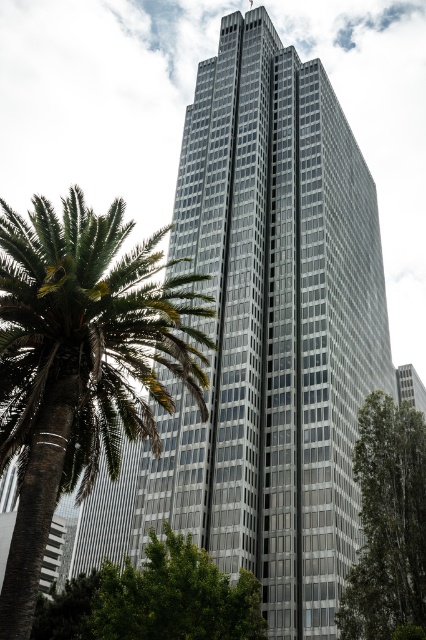
Who is taller, green leafy palm tree at left or green leafy tree at right?

Standing taller between the two is green leafy tree at right.

Looking at this image, is green leafy palm tree at left smaller than green leafy tree at right?

No, green leafy palm tree at left is not smaller than green leafy tree at right.

Is point (94, 326) behind point (417, 468)?

No, (94, 326) is closer to viewer.

Identify the location of green leafy palm tree at left. (80, 364).

Measure the distance between green leafy palm tree at left and green leafy tree at center.

green leafy palm tree at left is 41.79 feet away from green leafy tree at center.

Does point (112, 368) lie behind point (226, 584)?

That is False.

Image resolution: width=426 pixels, height=640 pixels. What do you see at coordinates (80, 364) in the screenshot?
I see `green leafy palm tree at left` at bounding box center [80, 364].

The image size is (426, 640). What are the coordinates of `green leafy palm tree at left` in the screenshot? It's located at (80, 364).

Does green leafy tree at right have a greater width compared to green leafy tree at center?

Incorrect, green leafy tree at right's width does not surpass green leafy tree at center's.

Can you confirm if green leafy tree at right is taller than green leafy tree at center?

Indeed, green leafy tree at right has a greater height compared to green leafy tree at center.

Locate an element on the screen. This screenshot has height=640, width=426. green leafy tree at right is located at coordinates (388, 524).